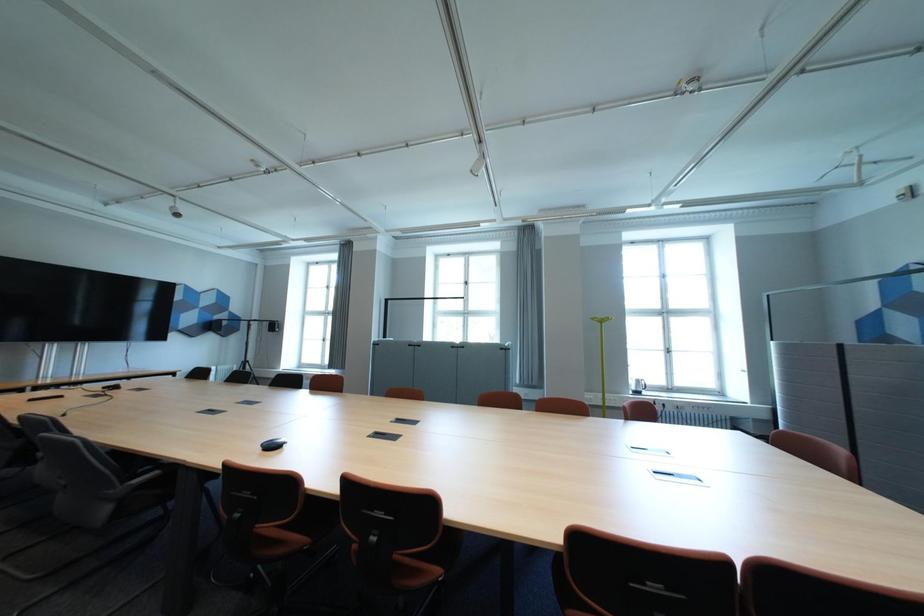
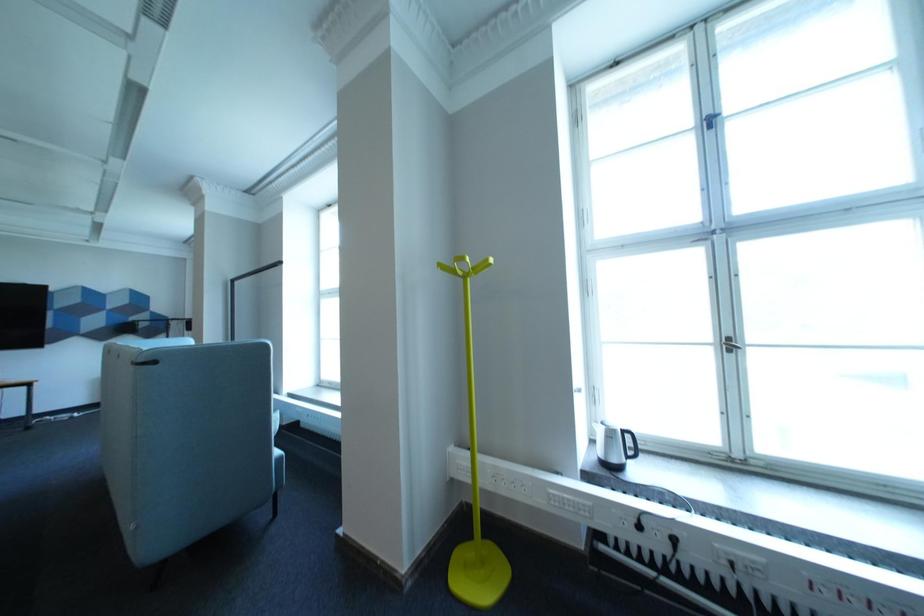
What movement of the cameraman would produce the second image?

The cameraman moved toward right, forward.